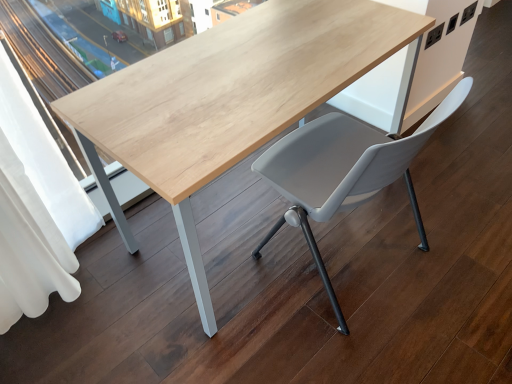
Where is `vacant space to the right of white fabric curtain at left`? vacant space to the right of white fabric curtain at left is located at coordinates (147, 302).